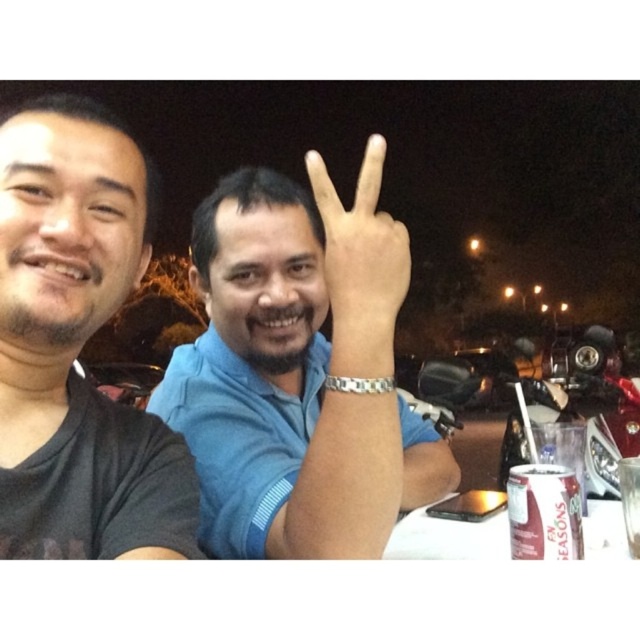
Does blue cotton shirt at center have a larger size compared to black matte shirt at left?

Indeed, blue cotton shirt at center has a larger size compared to black matte shirt at left.

From the picture: Does blue cotton shirt at center have a greater width compared to black matte shirt at left?

Yes.

Is point (368, 289) farther from viewer compared to point (86, 292)?

That is True.

What are the coordinates of `blue cotton shirt at center` in the screenshot? It's located at (298, 374).

Is black matte shirt at left closer to camera compared to silver metallic hand at center?

Yes, it is in front of silver metallic hand at center.

From the picture: Is black matte shirt at left bigger than silver metallic hand at center?

Correct, black matte shirt at left is larger in size than silver metallic hand at center.

Between point (24, 403) and point (358, 241), which one is positioned behind?

The point (24, 403) is behind.

This screenshot has height=640, width=640. In order to click on black matte shirt at left in this screenshot , I will do `click(76, 348)`.

Can you confirm if blue cotton shirt at center is positioned above white paper table at lower right?

Yes, blue cotton shirt at center is above white paper table at lower right.

Can you confirm if blue cotton shirt at center is taller than white paper table at lower right?

Yes, blue cotton shirt at center is taller than white paper table at lower right.

What do you see at coordinates (298, 374) in the screenshot? This screenshot has width=640, height=640. I see `blue cotton shirt at center` at bounding box center [298, 374].

At what (x,y) coordinates should I click in order to perform the action: click on blue cotton shirt at center. Please return your answer as a coordinate pair (x, y). Looking at the image, I should click on (298, 374).